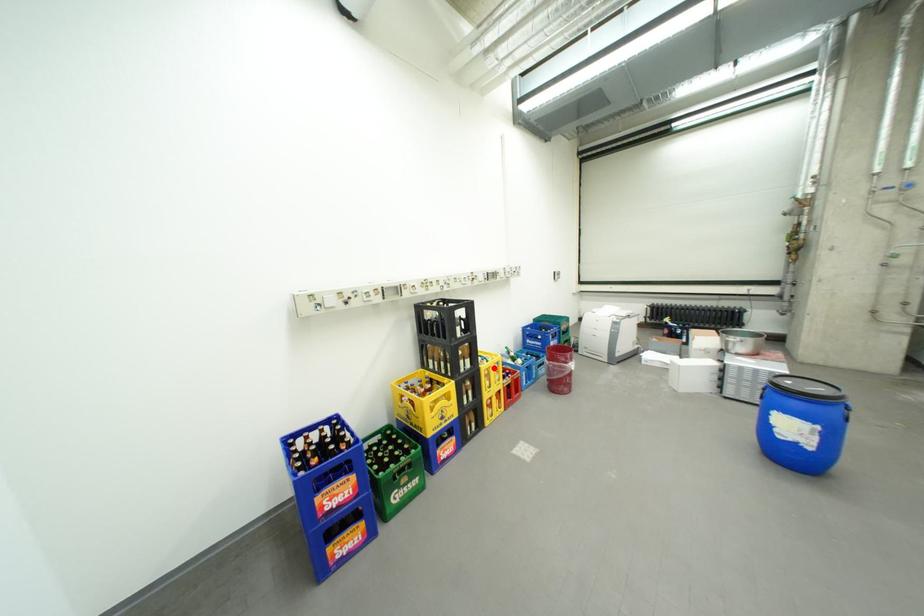
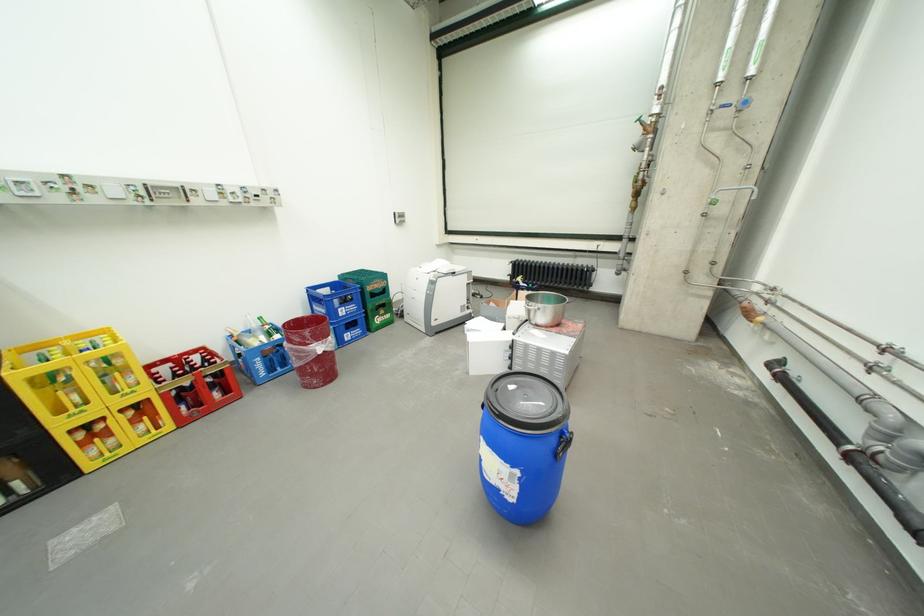
In the second image, find the point that corresponds to the highlighted location in the first image.

(30, 374)